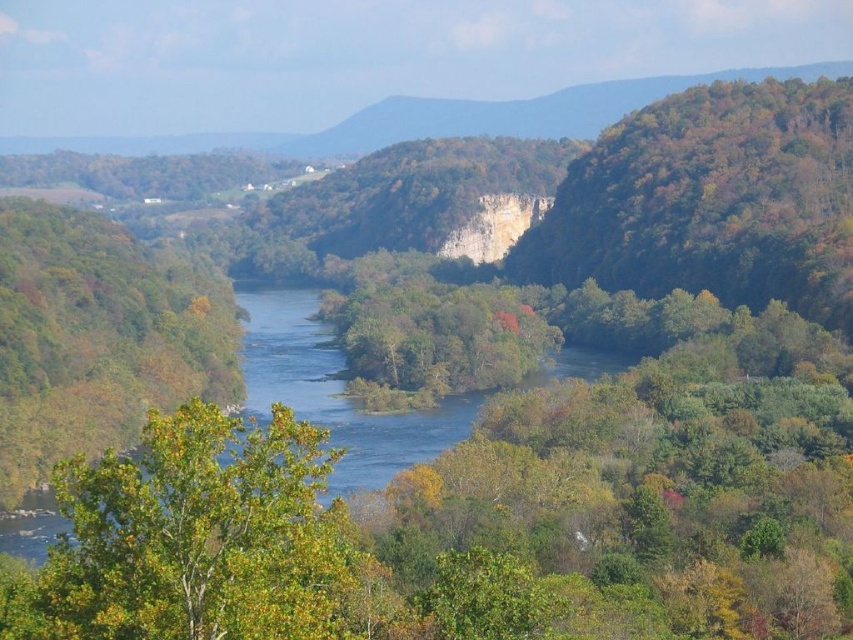
Can you confirm if green leafy tree at lower left is positioned to the right of green leafy tree at right?

No, green leafy tree at lower left is not to the right of green leafy tree at right.

Which is in front, point (44, 576) or point (601, 138)?

Point (44, 576) is more forward.

Describe the element at coordinates (195, 538) in the screenshot. I see `green leafy tree at lower left` at that location.

Locate an element on the screen. This screenshot has width=853, height=640. green leafy tree at lower left is located at coordinates (195, 538).

Does green leafy tree at left appear over green leafy trees at center?

No, green leafy tree at left is not above green leafy trees at center.

What do you see at coordinates (97, 337) in the screenshot? The height and width of the screenshot is (640, 853). I see `green leafy tree at left` at bounding box center [97, 337].

At what (x,y) coordinates should I click in order to perform the action: click on green leafy tree at left. Please return your answer as a coordinate pair (x, y). Image resolution: width=853 pixels, height=640 pixels. Looking at the image, I should click on (97, 337).

Can you confirm if green leafy tree at lower left is bigger than green leafy tree at left?

Actually, green leafy tree at lower left might be smaller than green leafy tree at left.

The width and height of the screenshot is (853, 640). What do you see at coordinates (195, 538) in the screenshot?
I see `green leafy tree at lower left` at bounding box center [195, 538].

The width and height of the screenshot is (853, 640). I want to click on green leafy tree at lower left, so click(195, 538).